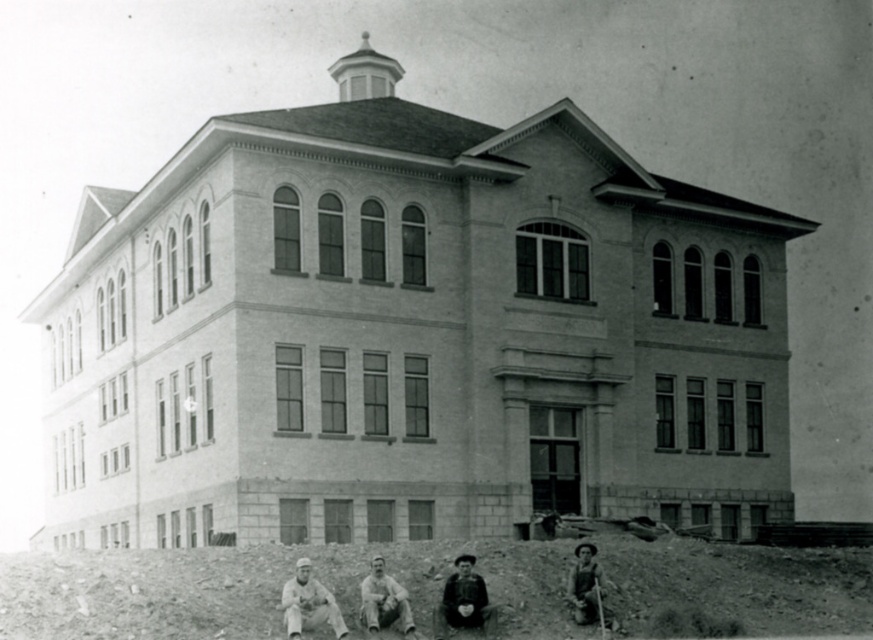
You are standing in front of the building and notice two items on the ground. Which item is closer to the left side of the image? Please choose between the dark brown leather jacket at lower center and the smooth wooden shovel at lower right.

The dark brown leather jacket at lower center is to the left of the smooth wooden shovel at lower right, so it is closer to the left side of the image.

In the scene shown: You are standing in front of the building and notice two points marked on the ground. The first point is at coordinates point (583, 596) and the second is at point (603, 628). Which point is closer to you?

Point (583, 596) is further to the camera than point (603, 628), so the point closer to you is point (603, 628).